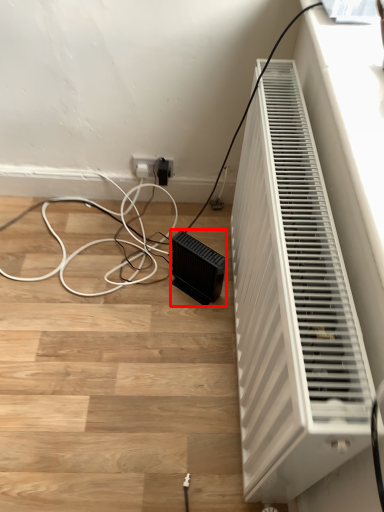
Question: From the image's perspective, what is the correct spatial relationship of speaker (annotated by the red box) in relation to home appliance?

Choices:
 (A) above
 (B) below

Answer: (A)